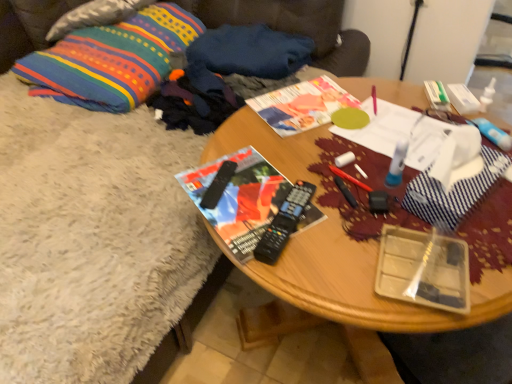
Locate an element on the screen. free spot in front of black plastic remote control at center, the 1th remote control positioned from the left is located at coordinates (241, 226).